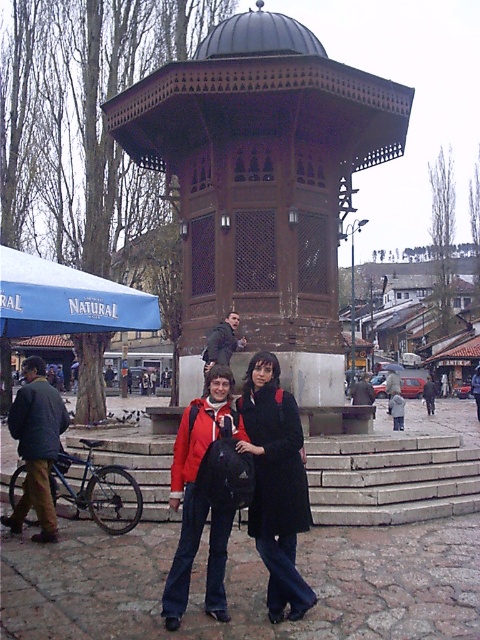
You are a tourist standing in the public square and want to take a photo of both the brown wooden gazebo at center and the dark brown wooden bench at center in the same frame. Which object should you position closer to the edge of the photo to ensure both are visible?

To include both the brown wooden gazebo at center and the dark brown wooden bench at center in the same photo frame, position the dark brown wooden bench at center closer to the edge since the brown wooden gazebo at center is on its right side.

You are standing in the public square and see two points marked in the image. Which point is closer to you, point (205, 227) or point (130, 296)?

Point (205, 227) is closer to you than point (130, 296).

From the picture: You are a photographer standing at the edge of the public square. You want to take a photo of the brown wooden gazebo at center and the dark brown wooden bench at center. Which object should you focus on first to ensure it appears sharp in the foreground?

You should focus on the brown wooden gazebo at center first because it is closer to you than the dark brown wooden bench at center, making it the foreground object.